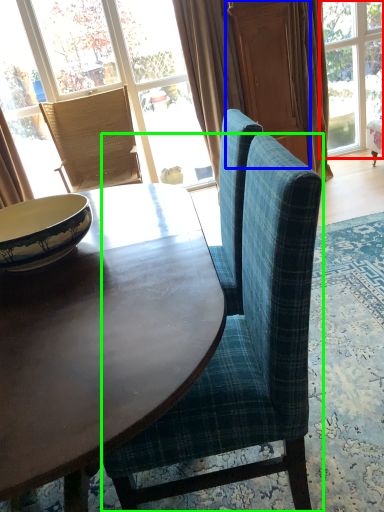
Question: Which object is positioned farthest from window (highlighted by a red box)? Select from screen door (highlighted by a blue box) and chair (highlighted by a green box).

Choices:
 (A) screen door
 (B) chair

Answer: (B)